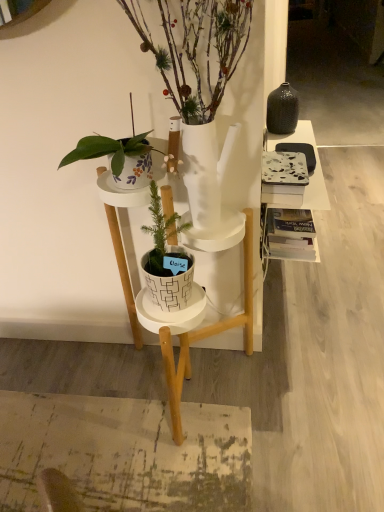
Question: From a real-world perspective, is white matte plant stand at center on white textured pot at center, marked as the 2th houseplant in a top-to-bottom arrangement?

Choices:
 (A) no
 (B) yes

Answer: (A)

Question: Can you confirm if white matte plant stand at center is positioned to the right of white textured pot at center, marked as the 2th houseplant in a top-to-bottom arrangement?

Choices:
 (A) no
 (B) yes

Answer: (B)

Question: From a real-world perspective, does white matte plant stand at center sit lower than white textured pot at center, positioned as the first houseplant in bottom-to-top order?

Choices:
 (A) no
 (B) yes

Answer: (B)

Question: Is white matte plant stand at center facing towards white textured pot at center, positioned as the first houseplant in bottom-to-top order?

Choices:
 (A) no
 (B) yes

Answer: (B)

Question: Considering the relative sizes of white matte plant stand at center and white textured pot at center, marked as the 2th houseplant in a top-to-bottom arrangement, in the image provided, is white matte plant stand at center thinner than white textured pot at center, marked as the 2th houseplant in a top-to-bottom arrangement,?

Choices:
 (A) yes
 (B) no

Answer: (B)

Question: Can you confirm if white matte plant stand at center is bigger than white textured pot at center, marked as the 2th houseplant in a top-to-bottom arrangement?

Choices:
 (A) no
 (B) yes

Answer: (B)

Question: Considering the relative positions of white glossy pot at center, which ranks as the 2th houseplant in bottom-to-top order, and marble-patterned book at right in the image provided, is white glossy pot at center, which ranks as the 2th houseplant in bottom-to-top order, to the left of marble-patterned book at right from the viewer's perspective?

Choices:
 (A) yes
 (B) no

Answer: (A)

Question: Is marble-patterned book at right at the back of white glossy pot at center, which ranks as the 2th houseplant in bottom-to-top order?

Choices:
 (A) yes
 (B) no

Answer: (A)

Question: Can you confirm if white glossy pot at center, arranged as the 1th houseplant when viewed from the top, is bigger than marble-patterned book at right?

Choices:
 (A) yes
 (B) no

Answer: (A)

Question: Is white glossy pot at center, arranged as the 1th houseplant when viewed from the top, at the right side of marble-patterned book at right?

Choices:
 (A) yes
 (B) no

Answer: (B)

Question: Is white glossy pot at center, arranged as the 1th houseplant when viewed from the top, shorter than marble-patterned book at right?

Choices:
 (A) yes
 (B) no

Answer: (B)

Question: Can you confirm if white glossy pot at center, which ranks as the 2th houseplant in bottom-to-top order, is taller than marble-patterned book at right?

Choices:
 (A) yes
 (B) no

Answer: (A)

Question: Does marble-patterned book at right lie behind white glossy pot at center, which ranks as the 2th houseplant in bottom-to-top order?

Choices:
 (A) no
 (B) yes

Answer: (B)